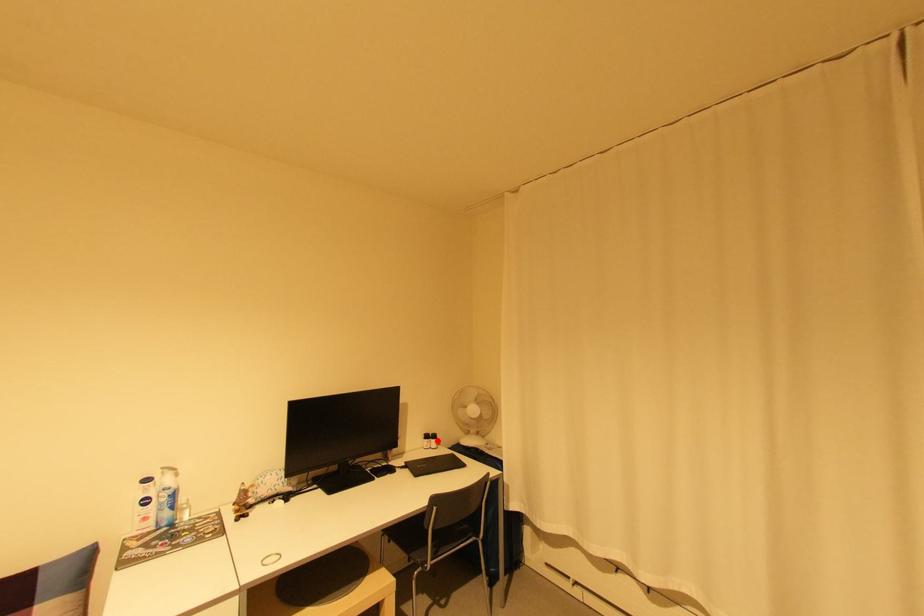
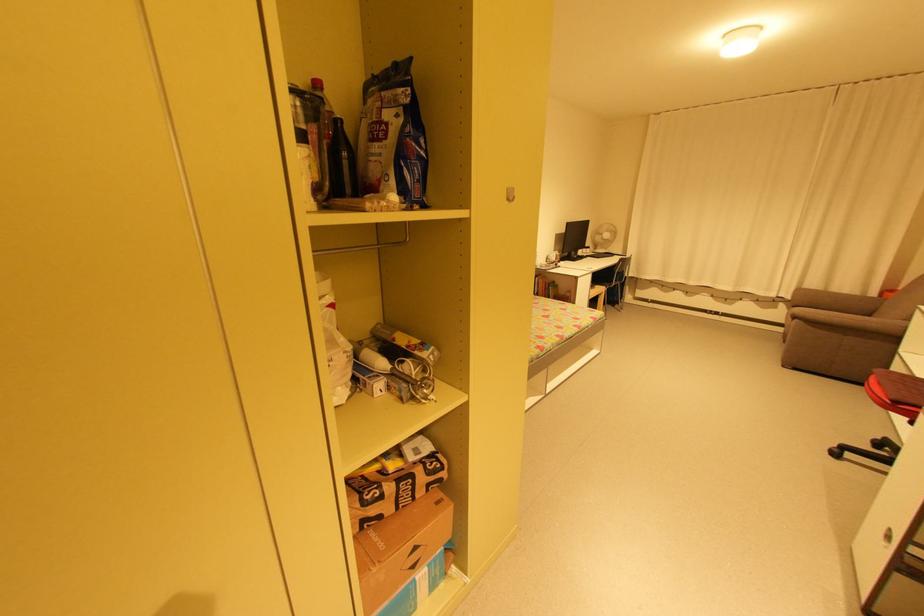
Where in the second image is the point corresponding to the highlighted location from the first image?

(592, 249)